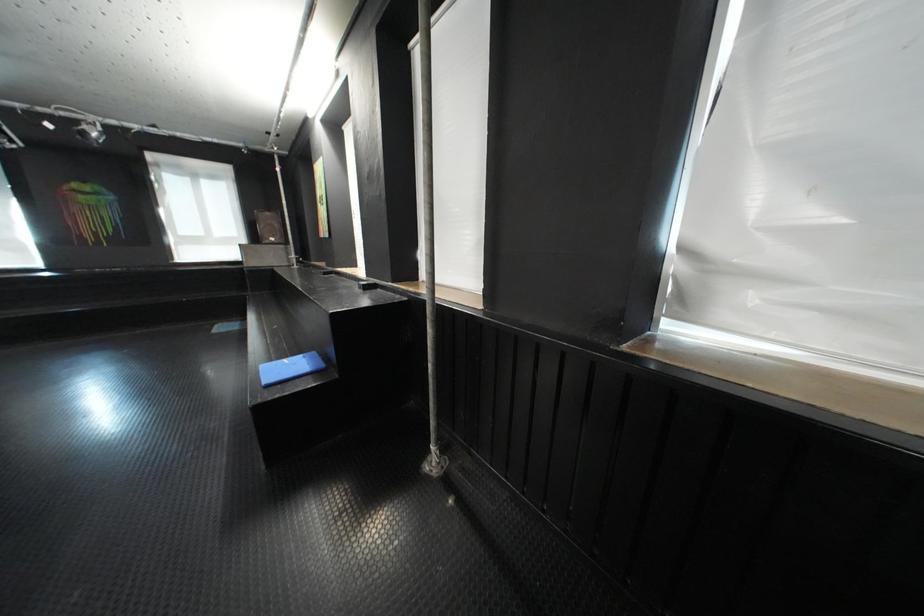
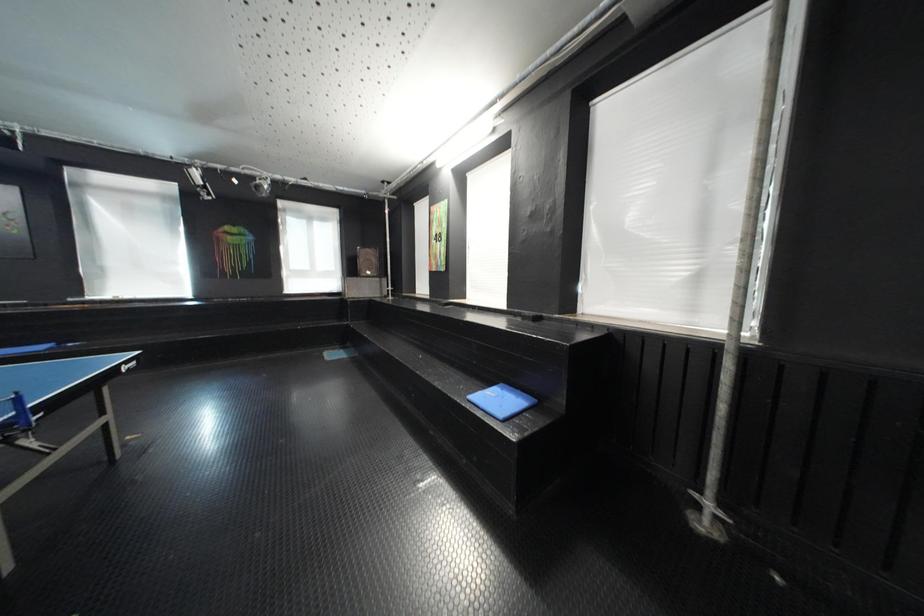
Question: What movement of the cameraman would produce the second image?

Choices:
 (A) Left
 (B) Right
 (C) Forward
 (D) Backward

Answer: (A)